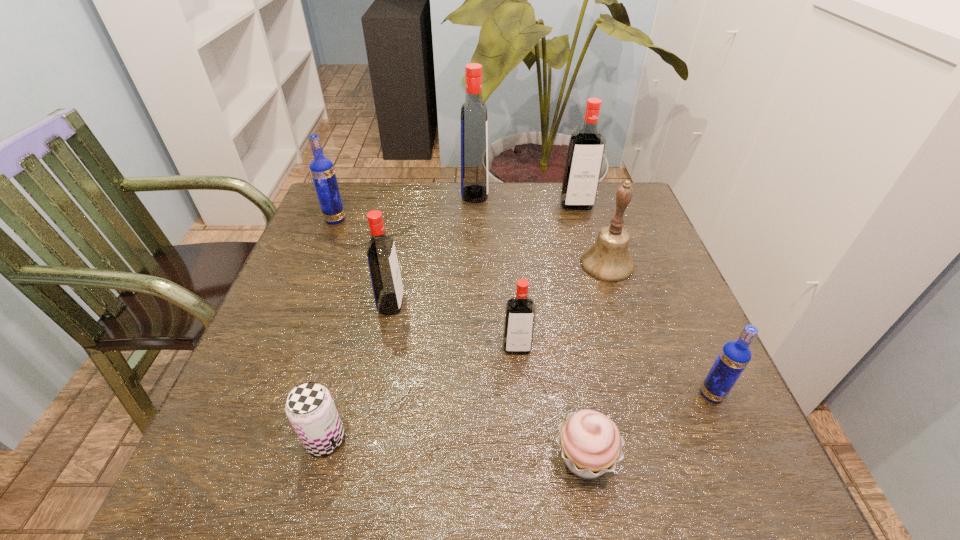
You are a GUI agent. You are given a task and a screenshot of the screen. Output one action in this format:
    pyautogui.click(x=<x>, y=<y>)
    Task: Click on the rightmost object
    
    Given the screenshot: What is the action you would take?
    pyautogui.click(x=734, y=357)

This screenshot has width=960, height=540. Identify the location of the fifth farthest vodka. (520, 311).

The height and width of the screenshot is (540, 960). What are the coordinates of `the nearest red vodka` in the screenshot? It's located at (520, 311).

This screenshot has height=540, width=960. Identify the location of the eighth object from right to left. (310, 408).

Find the location of a particular element. beer can is located at coordinates (310, 408).

Identify the location of pink cupcake. The image size is (960, 540). (590, 443).

Find the location of `the fourth object from right to left`. the fourth object from right to left is located at coordinates (590, 443).

Where is `vacant point located on the front and back of the tallest object`? Image resolution: width=960 pixels, height=540 pixels. vacant point located on the front and back of the tallest object is located at coordinates (525, 194).

Image resolution: width=960 pixels, height=540 pixels. In order to click on vacant area situated 0.340m on the front and back of the second vodka from right to left in this screenshot , I will do `click(603, 300)`.

Find the location of a particular element. vacant space located 0.180m on the front of the fourth nearest vodka is located at coordinates (314, 271).